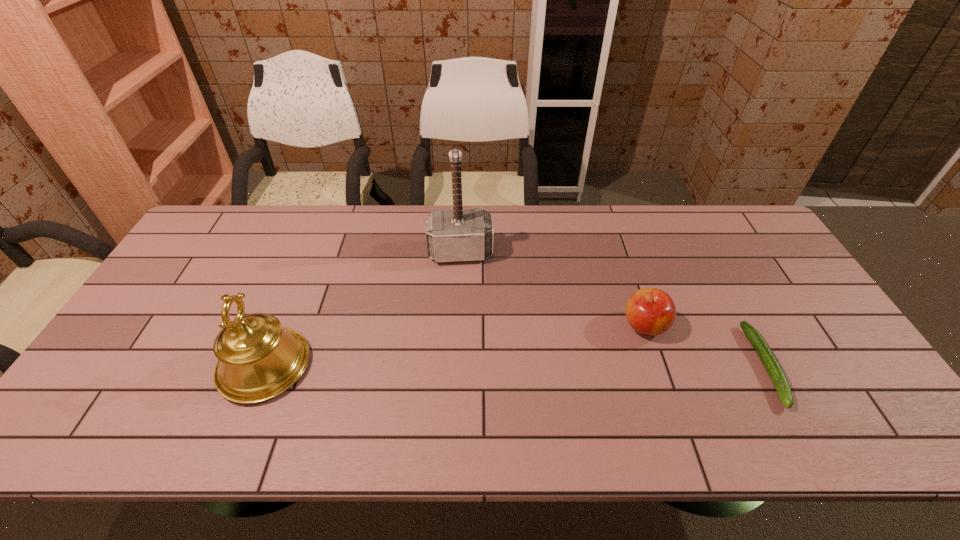
Where is `free space at the left edge`? This screenshot has height=540, width=960. free space at the left edge is located at coordinates (173, 338).

Image resolution: width=960 pixels, height=540 pixels. What are the coordinates of `free space at the right edge` in the screenshot? It's located at (761, 315).

At what (x,y) coordinates should I click in order to perform the action: click on vacant space at the far left corner of the desktop. Please return your answer as a coordinate pair (x, y). Looking at the image, I should click on (255, 207).

Where is `vacant space at the far right corner of the desktop`? vacant space at the far right corner of the desktop is located at coordinates (708, 224).

Locate an element on the screen. free space between the second object from right to left and the tallest object is located at coordinates (553, 289).

Identify the location of empty location between the third shortest object and the third object from left to right. The height and width of the screenshot is (540, 960). (455, 346).

The height and width of the screenshot is (540, 960). In order to click on vacant area that lies between the shortest object and the second object from right to left in this screenshot , I will do click(705, 346).

You are a GUI agent. You are given a task and a screenshot of the screen. Output one action in this format:
    pyautogui.click(x=<x>, y=<y>)
    Task: Click on the vacant space that is in between the shortest object and the second object from left to right
    
    Given the screenshot: What is the action you would take?
    pyautogui.click(x=612, y=309)

Identify the location of unoccupied area between the second tallest object and the rightmost object. This screenshot has width=960, height=540. (515, 366).

The image size is (960, 540). What are the coordinates of `vacant area that lies between the second object from right to left and the shortest object` in the screenshot? It's located at (705, 346).